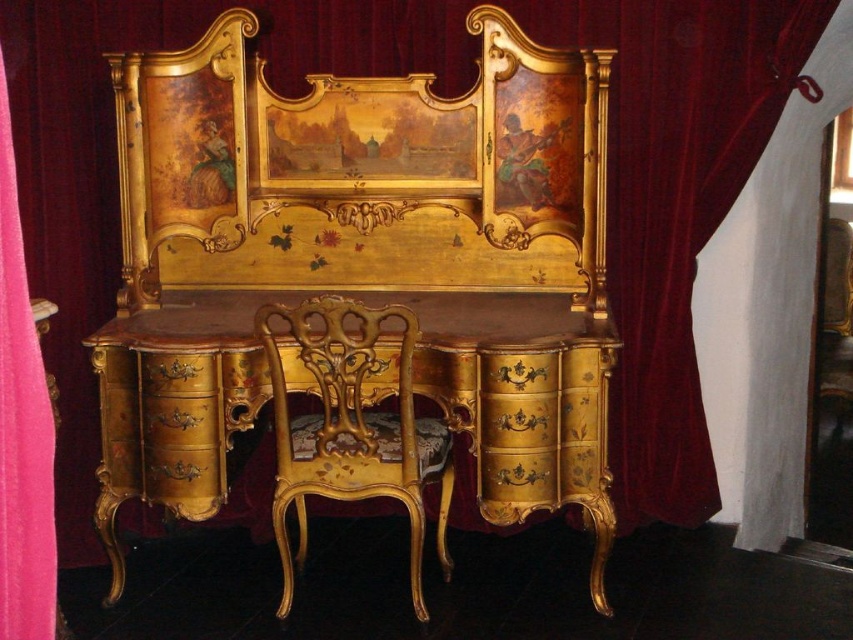
You are an interior designer arranging a room with the gold painted desk at center and the gold carved wood chair at center. Since both are at the center, how can you position them so they don not overlap?

The gold painted desk at center is above the gold carved wood chair at center, so you can place the desk on top of the chair or position the chair underneath the desk to avoid overlapping.

You are an interior designer planning to place a new sofa in the room. The sofa is 1.8 meters wide. You see the gold painted desk at center and the pink fabric curtain at left. Can the sofa fit between them without overlapping?

The gold painted desk at center might be wider than the pink fabric curtain at left. Since the desk could be wider, the space between them may not be sufficient for a 1.8 meter wide sofa. It is uncertain without exact measurements.